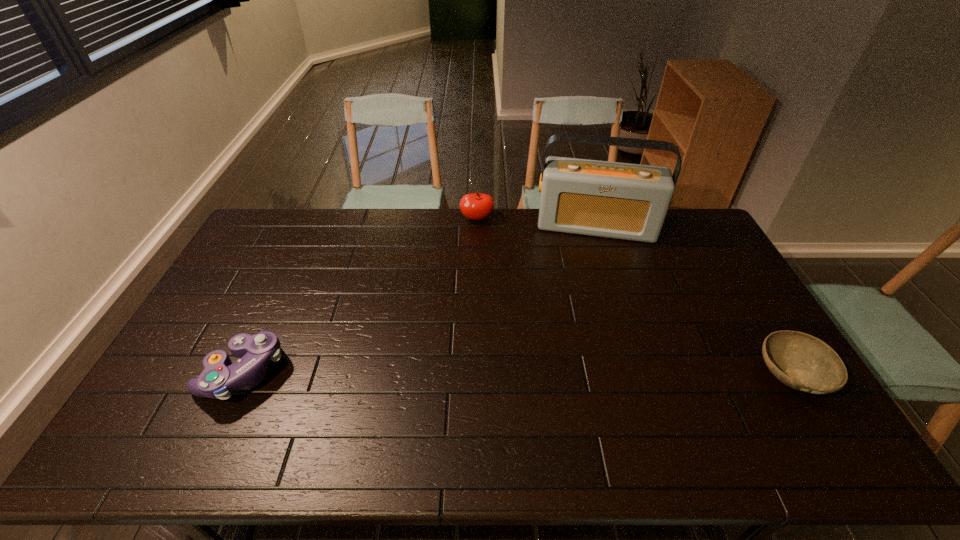
At what (x,y) coordinates should I click in order to perform the action: click on object present at the left edge. Please return your answer as a coordinate pair (x, y). The width and height of the screenshot is (960, 540). Looking at the image, I should click on (220, 377).

Locate an element on the screen. This screenshot has height=540, width=960. object that is at the right edge is located at coordinates (803, 362).

I want to click on object that is at the near left corner, so click(x=220, y=377).

I want to click on object located in the near right corner section of the desktop, so click(803, 362).

Where is `vacant space at the far edge`? vacant space at the far edge is located at coordinates (568, 239).

Locate an element on the screen. free space at the near edge of the desktop is located at coordinates (704, 397).

This screenshot has height=540, width=960. Find the location of `vacant space at the left edge of the desktop`. vacant space at the left edge of the desktop is located at coordinates (265, 287).

At what (x,y) coordinates should I click in order to perform the action: click on vacant position at the right edge of the desktop. Please return your answer as a coordinate pair (x, y). The image size is (960, 540). Looking at the image, I should click on pos(717,308).

Image resolution: width=960 pixels, height=540 pixels. In order to click on free space between the bowl and the third tallest object in this screenshot , I will do `click(517, 373)`.

Locate an element on the screen. The width and height of the screenshot is (960, 540). free spot between the bowl and the control is located at coordinates (517, 373).